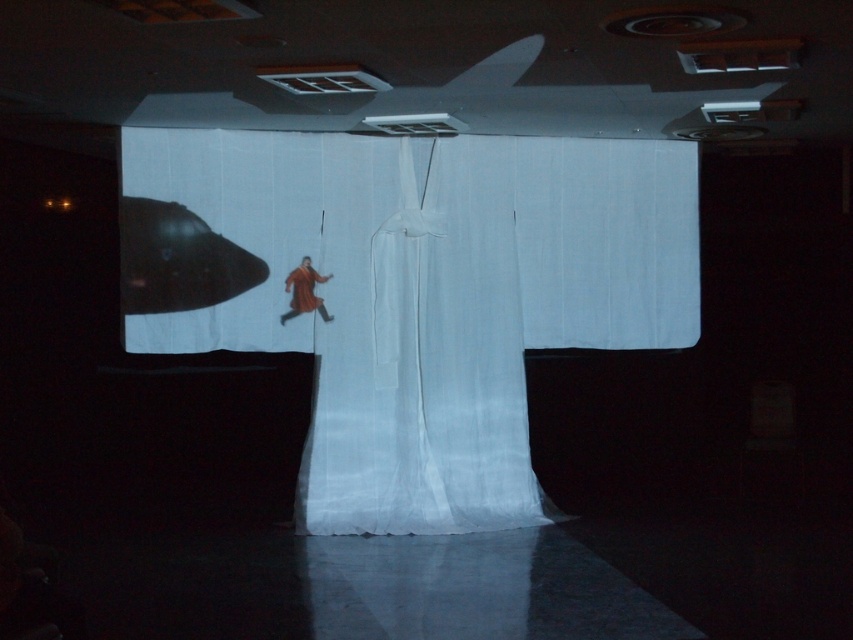
You are a stagehand preparing to adjust the lighting for a performance. You notice the white sheer curtain at center and the red velvet kimono at center. Which object is located to the left of the other?

The red velvet kimono at center is to the left of the white sheer curtain at center because the white sheer curtain at center is positioned on the right side of the red velvet kimono at center.

You are a stagehand trying to adjust the lighting for the performance. You need to ensure that the red velvet kimono at center is fully visible. Given that the white sheer curtain at center is currently blocking part of it, can you determine if moving the curtain backward will help achieve this?

The white sheer curtain at center is in front of the red velvet kimono at center. Moving the curtain backward would bring the kimono forward relative to the curtain, making it more visible. However, since both are at center, moving the curtain might not fully resolve the obstruction unless there is space to position it behind the kimono.